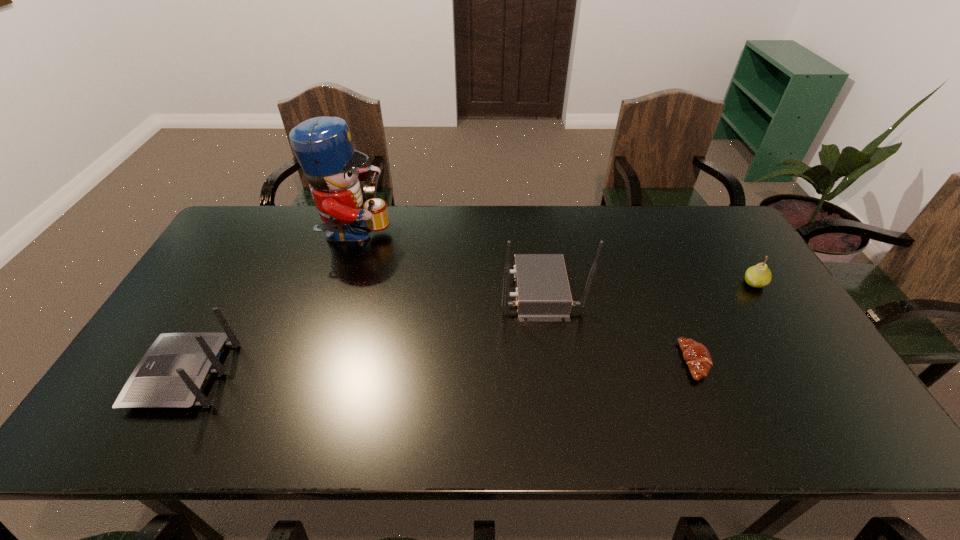
Image resolution: width=960 pixels, height=540 pixels. Identify the location of the second object from left to right. (323, 146).

Identify the location of nutcracker. (323, 146).

Find the location of a particular element. the farther router is located at coordinates pos(543,294).

You are a GUI agent. You are given a task and a screenshot of the screen. Output one action in this format:
    pyautogui.click(x=<x>, y=<y>)
    Task: Click on the right router
    The width and height of the screenshot is (960, 540).
    Given the screenshot: What is the action you would take?
    pyautogui.click(x=543, y=294)

Find the location of a particular element. The width and height of the screenshot is (960, 540). the nearer router is located at coordinates (173, 373).

Find the location of a particular element. the shorter router is located at coordinates [x=173, y=373].

The image size is (960, 540). Identify the location of pear. (758, 276).

The width and height of the screenshot is (960, 540). I want to click on the rightmost object, so click(758, 276).

The image size is (960, 540). In order to click on crescent roll in this screenshot , I will do `click(697, 357)`.

Locate an element on the screen. The width and height of the screenshot is (960, 540). the second object from right to left is located at coordinates (697, 357).